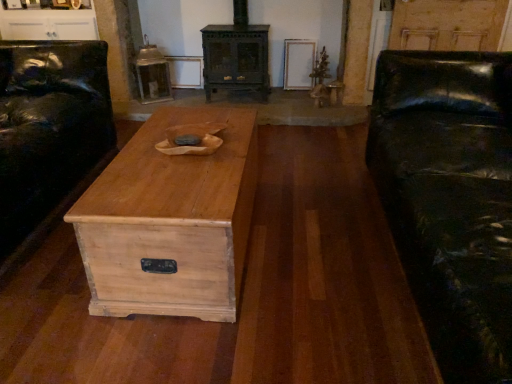
In order to face dark green wood stove at center, should I rotate leftwards or rightwards?

It's best to rotate left around 3.120 degrees.

Find the location of a particular element. dark green wood stove at center is located at coordinates (236, 59).

Describe the element at coordinates (450, 199) in the screenshot. This screenshot has width=512, height=384. I see `black leather couch at right` at that location.

Image resolution: width=512 pixels, height=384 pixels. Describe the element at coordinates (48, 127) in the screenshot. I see `black leather couch at left` at that location.

Where is `black leather couch at left`? This screenshot has height=384, width=512. black leather couch at left is located at coordinates (48, 127).

Where is `dark green wood stove at center`? dark green wood stove at center is located at coordinates (236, 59).

Between point (394, 178) and point (204, 29), which one is positioned in front?

The point (394, 178) is closer to the camera.

Would you consider black leather couch at right to be distant from dark green wood stove at center?

Yes, black leather couch at right is far from dark green wood stove at center.

Image resolution: width=512 pixels, height=384 pixels. In order to click on studio couch on the right of dark green wood stove at center in this screenshot , I will do `click(450, 199)`.

Which is behind, black leather couch at right or dark green wood stove at center?

dark green wood stove at center is more distant.

Is white glossy cabinet at upper left located outside natural wood chest at center?

Yes, white glossy cabinet at upper left is outside of natural wood chest at center.

From the image's perspective, which object appears higher, white glossy cabinet at upper left or natural wood chest at center?

From the image's view, white glossy cabinet at upper left is above.

Is white glossy cabinet at upper left behind natural wood chest at center?

Yes, the depth of white glossy cabinet at upper left is greater than that of natural wood chest at center.

Does black leather couch at left have a lesser height compared to natural wood chest at center?

In fact, black leather couch at left may be taller than natural wood chest at center.

Can you confirm if black leather couch at left is wider than natural wood chest at center?

Correct, the width of black leather couch at left exceeds that of natural wood chest at center.

Between black leather couch at left and natural wood chest at center, which one appears on the right side from the viewer's perspective?

From the viewer's perspective, natural wood chest at center appears more on the right side.

What's the angular difference between black leather couch at left and natural wood chest at center's facing directions?

180 degrees separate the facing orientations of black leather couch at left and natural wood chest at center.

Does black leather couch at right have a greater height compared to natural wood chest at center?

Yes, black leather couch at right is taller than natural wood chest at center.

Is black leather couch at right positioned far away from natural wood chest at center?

No, there isn't a large distance between black leather couch at right and natural wood chest at center.

Between black leather couch at right and natural wood chest at center, which one appears on the right side from the viewer's perspective?

black leather couch at right.

Is black leather couch at right positioned with its back to natural wood chest at center?

No.

Is natural wood chest at center inside or outside of black leather couch at left?

natural wood chest at center is outside black leather couch at left.

Considering the positions of point (201, 179) and point (7, 95), is point (201, 179) closer or farther from the camera than point (7, 95)?

Point (201, 179) is positioned closer to the camera compared to point (7, 95).

Considering the sizes of objects natural wood chest at center and black leather couch at left in the image provided, who is bigger, natural wood chest at center or black leather couch at left?

black leather couch at left.

From a real-world perspective, who is located higher, natural wood chest at center or black leather couch at left?

black leather couch at left, from a real-world perspective.

Can we say natural wood chest at center lies outside dark green wood stove at center?

Yes, natural wood chest at center is located beyond the bounds of dark green wood stove at center.

Considering the relative positions of natural wood chest at center and dark green wood stove at center in the image provided, is natural wood chest at center to the right of dark green wood stove at center from the viewer's perspective?

In fact, natural wood chest at center is to the left of dark green wood stove at center.

Does natural wood chest at center come behind dark green wood stove at center?

No.

Image resolution: width=512 pixels, height=384 pixels. In order to click on couch on the left of the black leather couch at right in this screenshot , I will do `click(48, 127)`.

Is black leather couch at right positioned far away from black leather couch at left?

Indeed, black leather couch at right is not near black leather couch at left.

From the image's perspective, is black leather couch at right under black leather couch at left?

Indeed, from the image's perspective, black leather couch at right is shown beneath black leather couch at left.

Between black leather couch at right and black leather couch at left, which one has larger size?

black leather couch at right.

Locate an element on the screen. The image size is (512, 384). studio couch that is in front of the dark green wood stove at center is located at coordinates (450, 199).

What are the coordinates of `entertainment center that appears above the natural wood chest at center (from the image's perspective)` in the screenshot? It's located at (48, 20).

Looking at the image, which one is located further to white glossy cabinet at upper left, black leather couch at right or natural wood chest at center?

→ black leather couch at right is further to white glossy cabinet at upper left.

Based on their spatial positions, is black leather couch at left or black leather couch at right closer to dark green wood stove at center?

black leather couch at left.

Estimate the real-world distances between objects in this image. Which object is closer to black leather couch at right, dark green wood stove at center or white glossy cabinet at upper left?

dark green wood stove at center.

In the scene shown: Estimate the real-world distances between objects in this image. Which object is closer to natural wood chest at center, black leather couch at right or white glossy cabinet at upper left?

Among the two, black leather couch at right is located nearer to natural wood chest at center.

Based on the photo, looking at the image, which one is located closer to natural wood chest at center, white glossy cabinet at upper left or dark green wood stove at center?

Among the two, dark green wood stove at center is located nearer to natural wood chest at center.

Based on their spatial positions, is black leather couch at right or dark green wood stove at center further from natural wood chest at center?

dark green wood stove at center.

Based on their spatial positions, is natural wood chest at center or black leather couch at left further from dark green wood stove at center?

natural wood chest at center lies further to dark green wood stove at center than the other object.

When comparing their distances from dark green wood stove at center, does natural wood chest at center or white glossy cabinet at upper left seem further?

Based on the image, natural wood chest at center appears to be further to dark green wood stove at center.

Find the location of a particular element. The image size is (512, 384). stove between black leather couch at right and white glossy cabinet at upper left from front to back is located at coordinates (236, 59).

This screenshot has width=512, height=384. I want to click on chest of drawers between black leather couch at right and dark green wood stove at center in the front-back direction, so click(170, 222).

This screenshot has height=384, width=512. Find the location of `couch between white glossy cabinet at upper left and black leather couch at right in the horizontal direction`. couch between white glossy cabinet at upper left and black leather couch at right in the horizontal direction is located at coordinates (48, 127).

At what (x,y) coordinates should I click in order to perform the action: click on stove between natural wood chest at center and white glossy cabinet at upper left along the z-axis. Please return your answer as a coordinate pair (x, y). The width and height of the screenshot is (512, 384). Looking at the image, I should click on (236, 59).